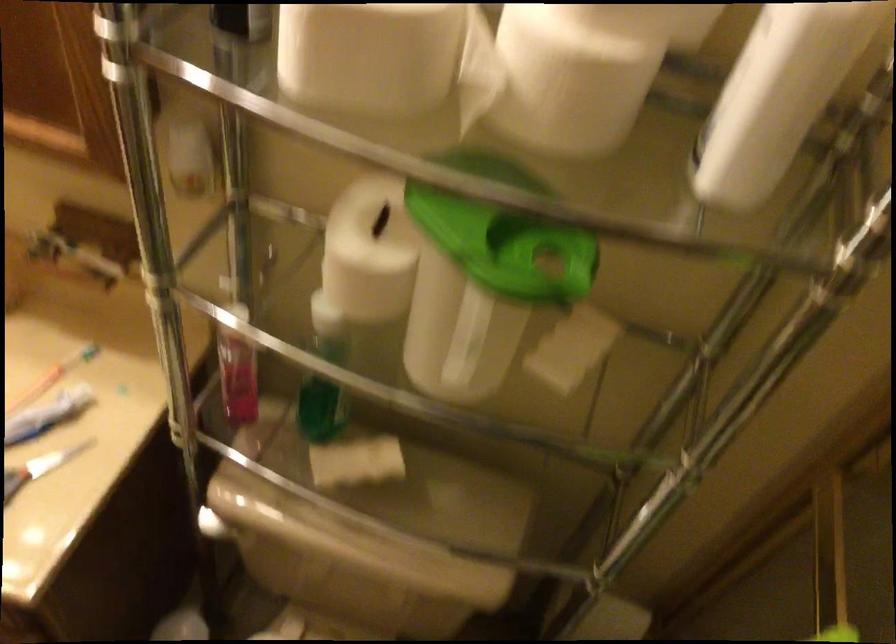
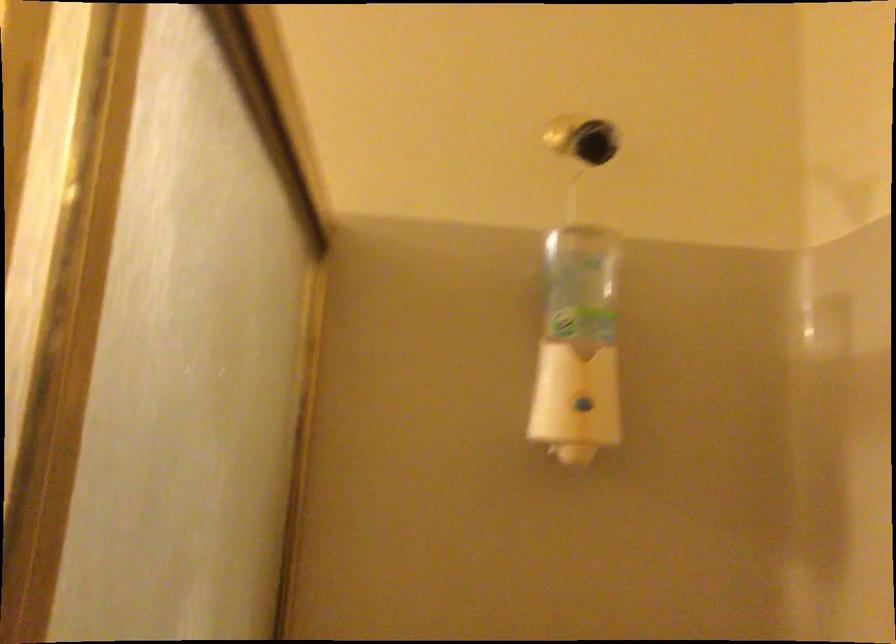
First-person continuous shooting, in which direction is the camera rotating?

The rotation direction of the camera is right-up.